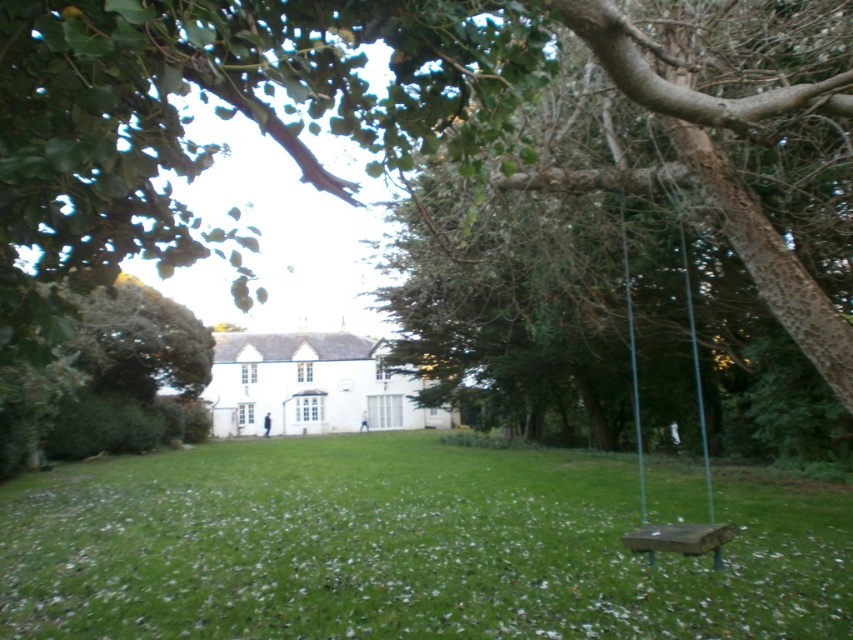
Between smooth bark tree at center and wooden swing at right, which one appears on the right side from the viewer's perspective?

From the viewer's perspective, wooden swing at right appears more on the right side.

Identify the location of smooth bark tree at center. The height and width of the screenshot is (640, 853). (635, 266).

Which is above, green grass at lower center or wooden swing at right?

wooden swing at right is above.

Does green grass at lower center appear on the right side of wooden swing at right?

No, green grass at lower center is not to the right of wooden swing at right.

Is point (630, 595) less distant than point (712, 529)?

No, it is behind (712, 529).

The width and height of the screenshot is (853, 640). Identify the location of green grass at lower center. (402, 552).

Which is in front, point (808, 58) or point (717, 611)?

Point (717, 611) is in front.

Is smooth bark tree at center to the right of green grass at lower center from the viewer's perspective?

Yes, smooth bark tree at center is to the right of green grass at lower center.

Is point (850, 355) less distant than point (167, 582)?

That is True.

Where is `smooth bark tree at center`? smooth bark tree at center is located at coordinates (635, 266).